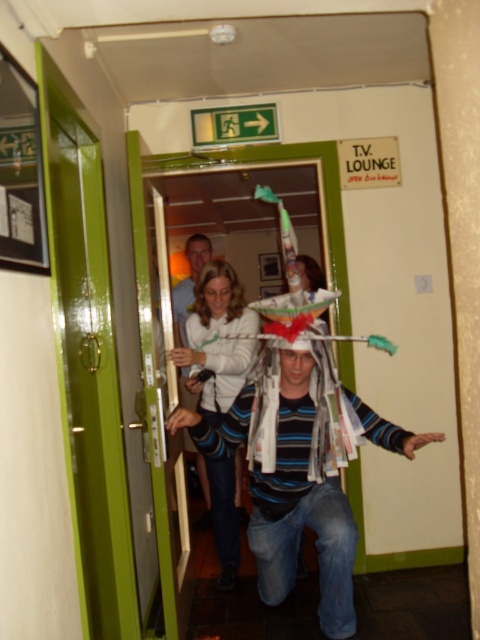
Is the position of white fabric at center less distant than that of striped cotton shirt at center?

Yes, it is.

Does white fabric at center appear on the left side of striped cotton shirt at center?

No, white fabric at center is not to the left of striped cotton shirt at center.

Which is behind, point (216, 289) or point (189, 292)?

The point (189, 292) is more distant.

Identify the location of white fabric at center. (217, 339).